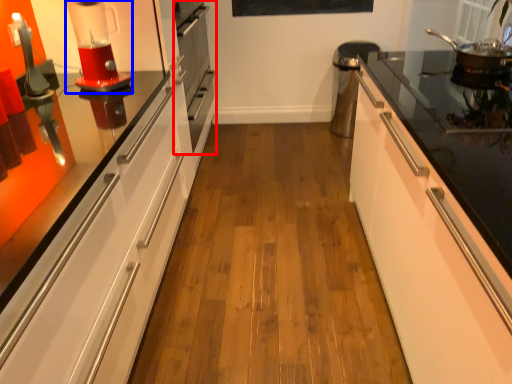
Question: Which of the following is the farthest to the observer, oven (highlighted by a red box) or home appliance (highlighted by a blue box)?

Choices:
 (A) oven
 (B) home appliance

Answer: (A)